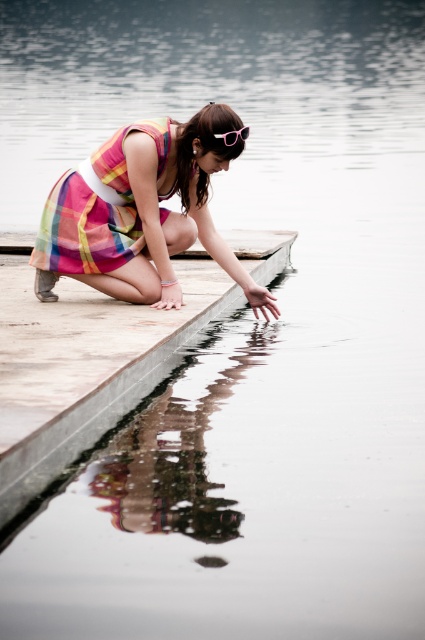
You are a photographer trying to capture the reflection of the plaid fabric dress at center and the pink plastic goggles at center in the water. Which object will appear higher in the reflection?

The plaid fabric dress at center is positioned under the pink plastic goggles at center, so in the reflection, the pink plastic goggles at center will appear higher than the plaid fabric dress at center.

From the picture: You are a fashion designer observing a model wearing a plaid fabric dress at center and pink plastic goggles at center. You want to adjust the goggles so that they are closer to the dress. How much distance do you need to reduce between them?

The plaid fabric dress at center and pink plastic goggles at center are currently 34.50 inches apart. To make them closer, you need to reduce the distance between them by 34.50 inches.

Based on the photo, where is the plaid fabric dress at center located in the image?

The plaid fabric dress at center is located at point (144, 211).